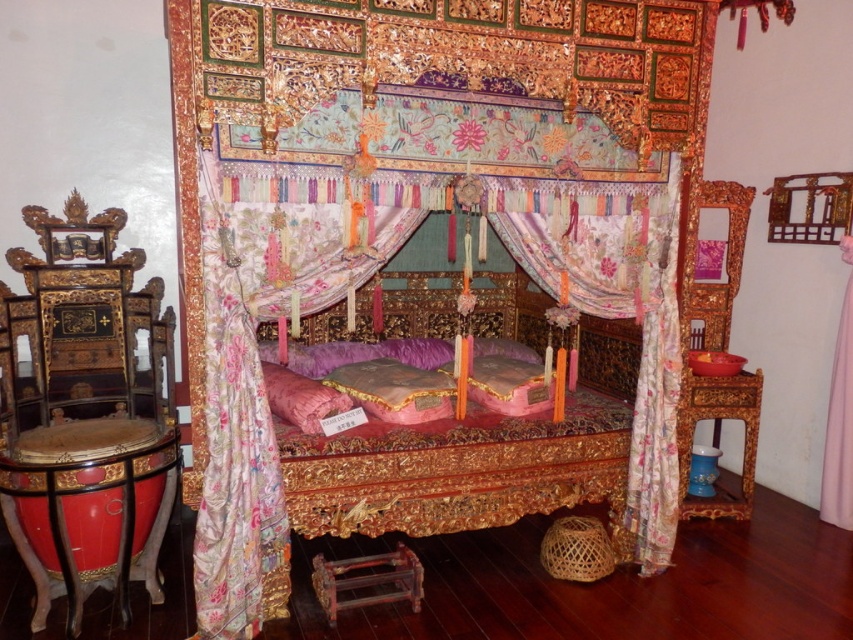
You are a painter standing at the foot of the ornate bed. You want to move your 1.5 meter long ladder from the floral silk curtain at right to the pink satin curtain at right. Can you move it horizontally without tilting it?

The distance between the floral silk curtain at right and pink satin curtain at right is 1.22 meters. Since the ladder is 1.5 meters long, which is longer than the available space, you cannot move it horizontally without tilting it.

You are standing in a room with an ornate bed surrounded by two curtains on the right side. The curtains are labeled as the floral silk curtain at right and the pink satin curtain at right. Which of these two curtains is taller?

The floral silk curtain at right is taller than the pink satin curtain at right according to the description.